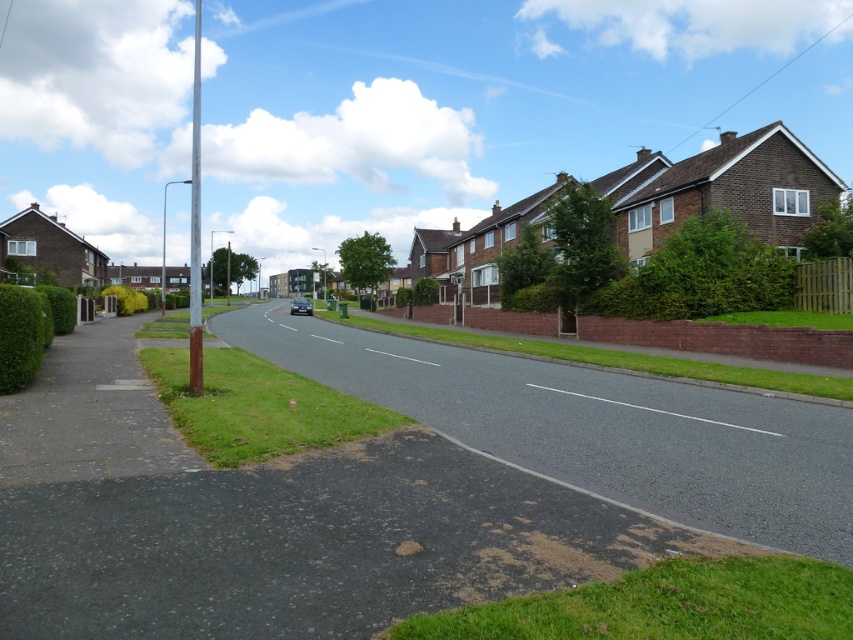
Question: Is asphalt road at center further to camera compared to smooth asphalt road at center?

Choices:
 (A) yes
 (B) no

Answer: (B)

Question: Does asphalt road at center appear under smooth asphalt road at center?

Choices:
 (A) no
 (B) yes

Answer: (B)

Question: Can you confirm if asphalt road at center is positioned to the right of smooth asphalt road at center?

Choices:
 (A) no
 (B) yes

Answer: (A)

Question: Which point appears farthest from the camera in this image?

Choices:
 (A) (820, 512)
 (B) (715, 422)

Answer: (B)